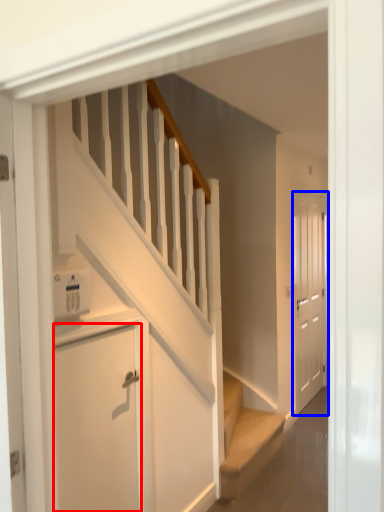
Question: Which object appears closest to the camera in this image, door (highlighted by a red box) or door (highlighted by a blue box)?

Choices:
 (A) door
 (B) door

Answer: (A)